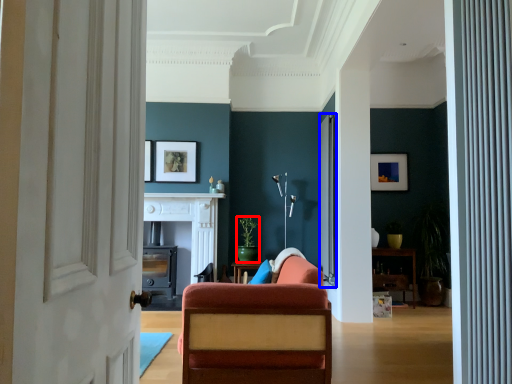
Question: Which object is further to the camera taking this photo, houseplant (highlighted by a red box) or screen door (highlighted by a blue box)?

Choices:
 (A) houseplant
 (B) screen door

Answer: (A)